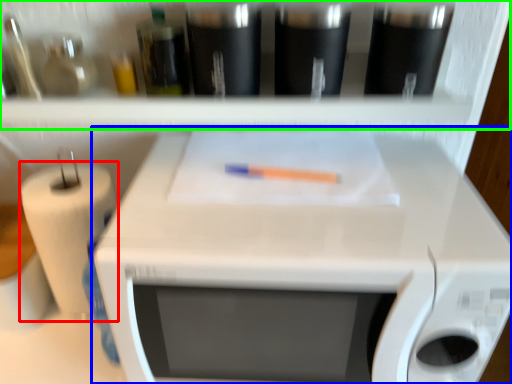
Question: Which is nearer to the paper towel (highlighted by a red box)? appliance (highlighted by a blue box) or shelf (highlighted by a green box).

Choices:
 (A) appliance
 (B) shelf

Answer: (A)